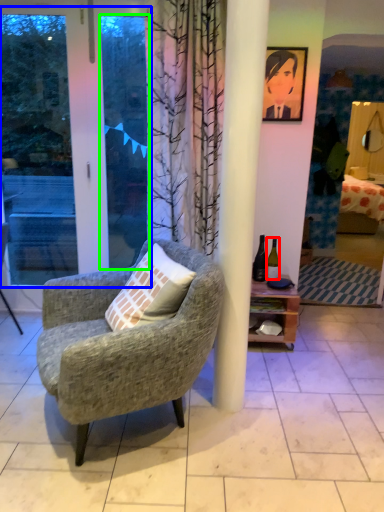
Question: Which object is positioned closest to bottle (highlighted by a red box)? Select from screen door (highlighted by a blue box) and window screen (highlighted by a green box).

Choices:
 (A) screen door
 (B) window screen

Answer: (B)